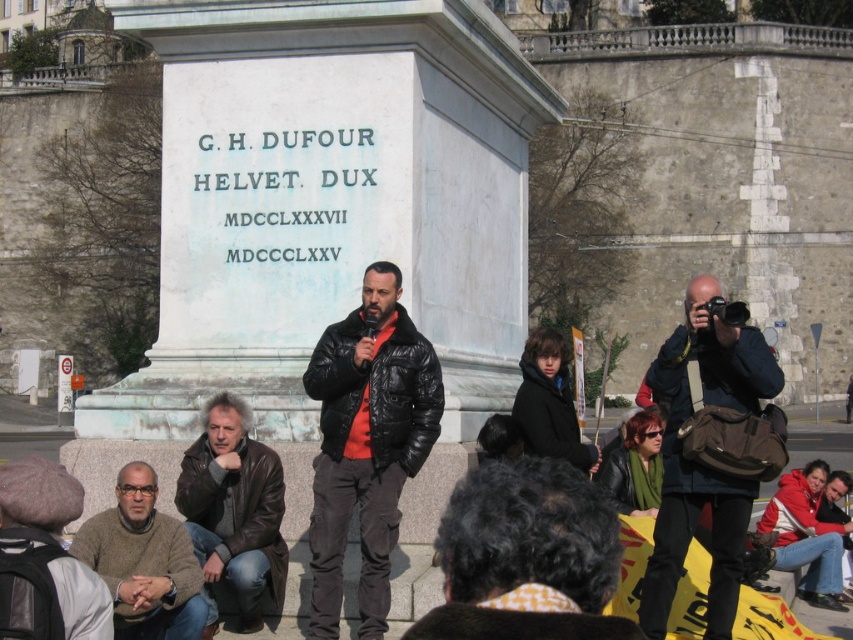
This screenshot has width=853, height=640. Describe the element at coordinates (701, 468) in the screenshot. I see `dark blue jacket at right` at that location.

Does dark blue jacket at right have a greater height compared to leather jacket at lower left?

Indeed, dark blue jacket at right has a greater height compared to leather jacket at lower left.

I want to click on dark blue jacket at right, so click(x=701, y=468).

You are a GUI agent. You are given a task and a screenshot of the screen. Output one action in this format:
    pyautogui.click(x=<x>, y=<y>)
    Task: Click on the dark blue jacket at right
    The image size is (853, 640).
    Given the screenshot: What is the action you would take?
    pyautogui.click(x=701, y=468)

Is brown sweater at lower left smaller than red jacket at lower right?

No.

Consider the image. Which is more to the left, brown sweater at lower left or red jacket at lower right?

brown sweater at lower left is more to the left.

Find the location of a particular element. brown sweater at lower left is located at coordinates (143, 561).

From the picture: Is the position of black matte jacket at center less distant than that of leather jacket at lower left?

Yes, black matte jacket at center is in front of leather jacket at lower left.

Measure the distance from black matte jacket at center to leather jacket at lower left.

black matte jacket at center and leather jacket at lower left are 1.30 meters apart.

You are a GUI agent. You are given a task and a screenshot of the screen. Output one action in this format:
    pyautogui.click(x=<x>, y=<y>)
    Task: Click on the black matte jacket at center
    The image size is (853, 640).
    Given the screenshot: What is the action you would take?
    pyautogui.click(x=366, y=444)

This screenshot has height=640, width=853. I want to click on black matte jacket at center, so click(366, 444).